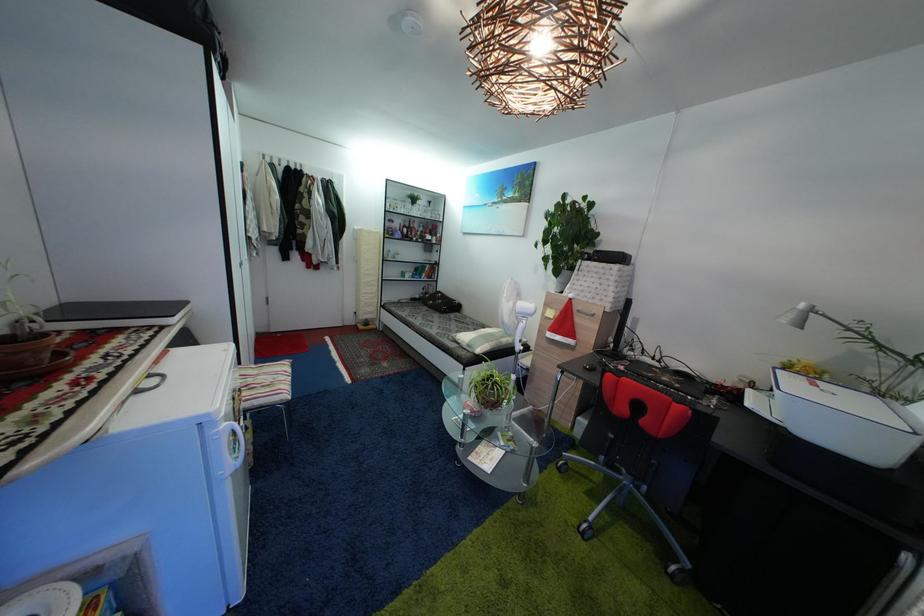
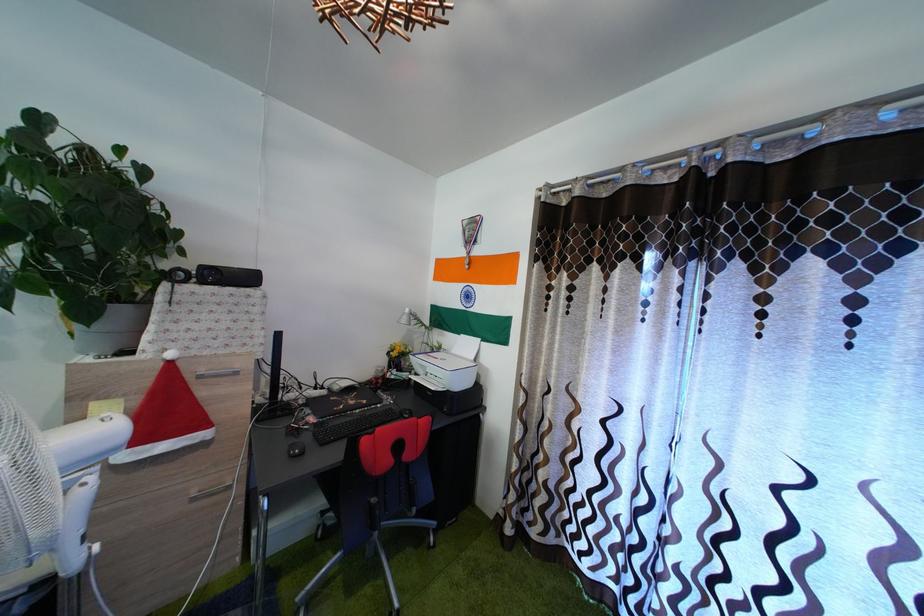
Locate, in the second image, the point that corresponds to [574,280] in the first image.

(128, 318)